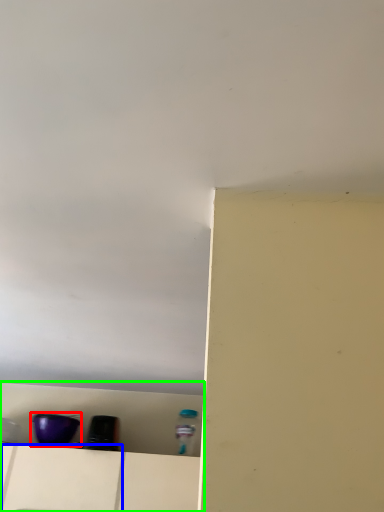
Question: Which is farther away from appliance (highlighted by a red box)? drawer (highlighted by a blue box) or shelf (highlighted by a green box)?

Choices:
 (A) drawer
 (B) shelf

Answer: (B)